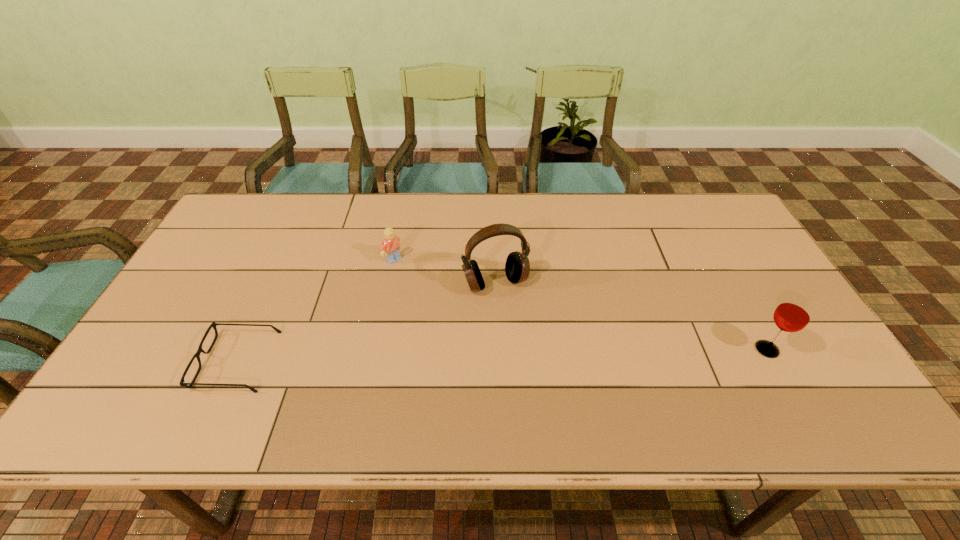
What are the coordinates of `vacant space on the desktop that is between the spectacles and the glass and is positioned on the ear pads of the third object from left to right` in the screenshot? It's located at (525, 355).

The width and height of the screenshot is (960, 540). In order to click on free space on the desktop that is between the shortest object and the rightmost object and is positioned on the front-facing side of the farthest object in this screenshot , I will do `click(508, 355)`.